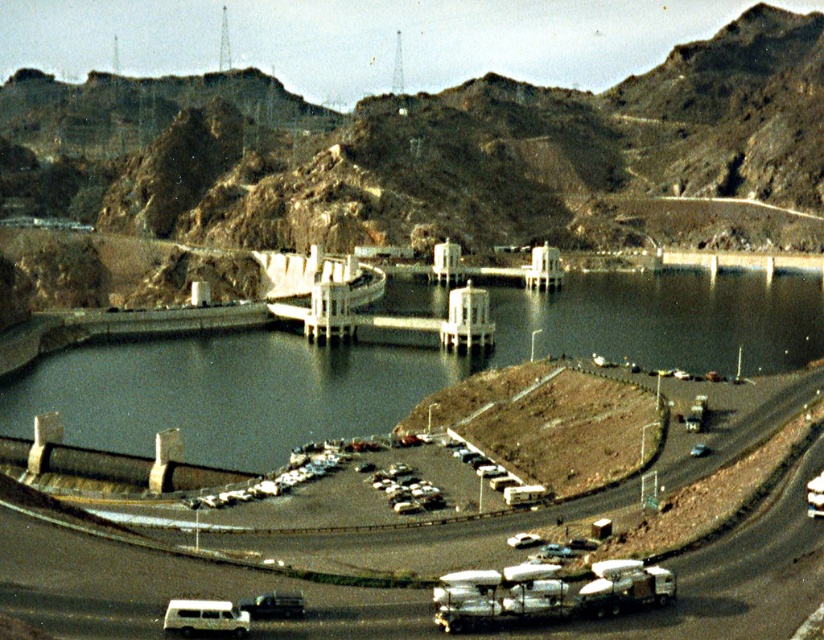
You are planning to park your vehicle at the dam parking area. You have a white matte van at lower left and a metallic silver car at center. Which vehicle takes up more space in the parking spot?

The white matte van at lower left takes up more space in the parking spot because it has a larger size compared to the metallic silver car at center.

You are a tour guide planning to move a 100 feet long tour bus from the white matte car at center to the metallic silver car at center. Can the tour bus fit between them without any obstacles?

The distance between the white matte car at center and the metallic silver car at center is 98.75 feet. Since the tour bus is 100 feet long, it cannot fit between them as the required space is slightly less than the bus length.

You are standing at the point labeled point (406, 490) in the image. What object is located at this point?

The point (406, 490) corresponds to the white matte car at center.